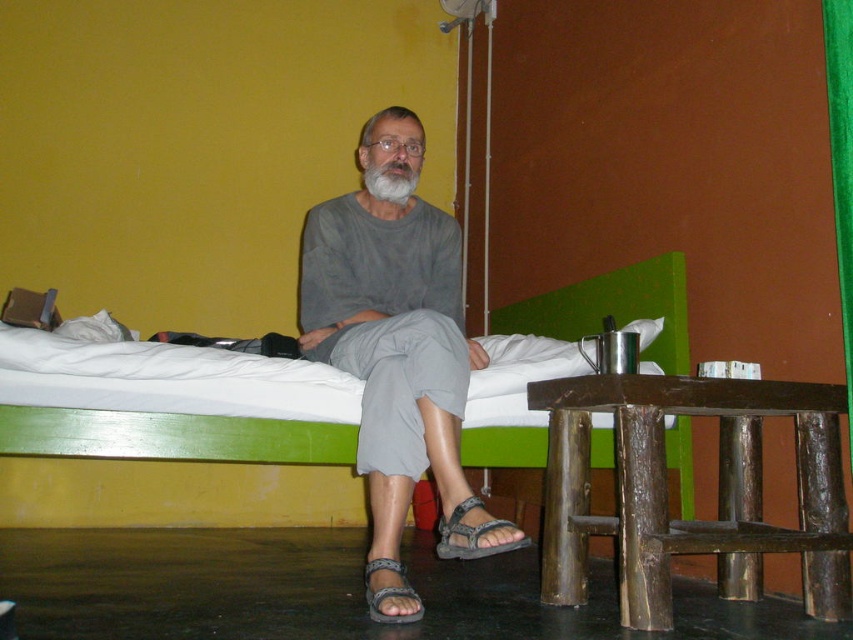
You are standing at point (838, 1) and want to walk to point (494, 524). Is the destination point in front of you?

Yes, the destination point (494, 524) is in front of you because it is located in front of your current position at point (838, 1).

You are a fashion designer observing the man in the scene. You need to determine which item is taller between the gray cotton shirt at center and the green velvet curtain at right. Which one is taller?

The gray cotton shirt at center is taller than the green velvet curtain at right according to the description.

You are a photographer taking a closeup shot of the gray matte beard at center and the brown woven sandal at lower center. Which object should you focus on first if you want to capture both in sharp focus, considering their sizes?

The gray matte beard at center is wider than the brown woven sandal at lower center, so you should focus on the gray matte beard at center first to ensure both are in sharp focus.